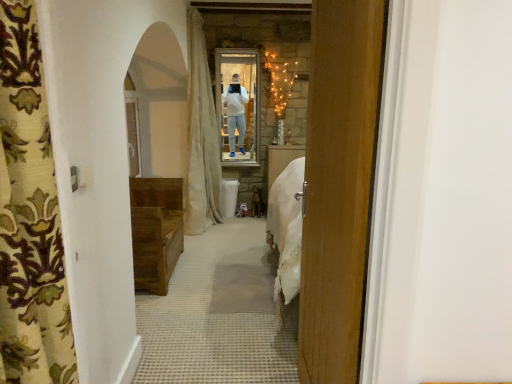
Question: Does matte glass mirror at center appear on the right side of patterned fabric curtain at left, acting as the 2th curtain starting from the back?

Choices:
 (A) no
 (B) yes

Answer: (B)

Question: Is matte glass mirror at center positioned in front of patterned fabric curtain at left, acting as the 2th curtain starting from the back?

Choices:
 (A) yes
 (B) no

Answer: (B)

Question: Could patterned fabric curtain at left, the first curtain viewed from the front, be considered to be inside matte glass mirror at center?

Choices:
 (A) yes
 (B) no

Answer: (B)

Question: Can you confirm if matte glass mirror at center is bigger than patterned fabric curtain at left, acting as the 2th curtain starting from the back?

Choices:
 (A) yes
 (B) no

Answer: (B)

Question: From the image's perspective, is matte glass mirror at center on top of patterned fabric curtain at left, the first curtain viewed from the front?

Choices:
 (A) no
 (B) yes

Answer: (B)

Question: From a real-world perspective, is matte glass mirror at center on patterned fabric curtain at left, acting as the 2th curtain starting from the back?

Choices:
 (A) yes
 (B) no

Answer: (A)

Question: Can you confirm if wooden door at center is bigger than white fabric curtain at center, the 2th curtain viewed from the front?

Choices:
 (A) no
 (B) yes

Answer: (A)

Question: Is wooden door at center not near white fabric curtain at center, placed as the first curtain when sorted from back to front?

Choices:
 (A) no
 (B) yes

Answer: (B)

Question: Is wooden door at center to the left of white fabric curtain at center, the 2th curtain viewed from the front, from the viewer's perspective?

Choices:
 (A) no
 (B) yes

Answer: (A)

Question: Can you confirm if wooden door at center is thinner than white fabric curtain at center, placed as the first curtain when sorted from back to front?

Choices:
 (A) yes
 (B) no

Answer: (A)

Question: From the image's perspective, does wooden door at center appear lower than white fabric curtain at center, the 2th curtain viewed from the front?

Choices:
 (A) yes
 (B) no

Answer: (A)

Question: Is the depth of wooden door at center greater than that of white fabric curtain at center, the 2th curtain viewed from the front?

Choices:
 (A) no
 (B) yes

Answer: (A)

Question: Does patterned fabric curtain at left, the first curtain viewed from the front, have a lesser width compared to wooden door at center?

Choices:
 (A) yes
 (B) no

Answer: (B)